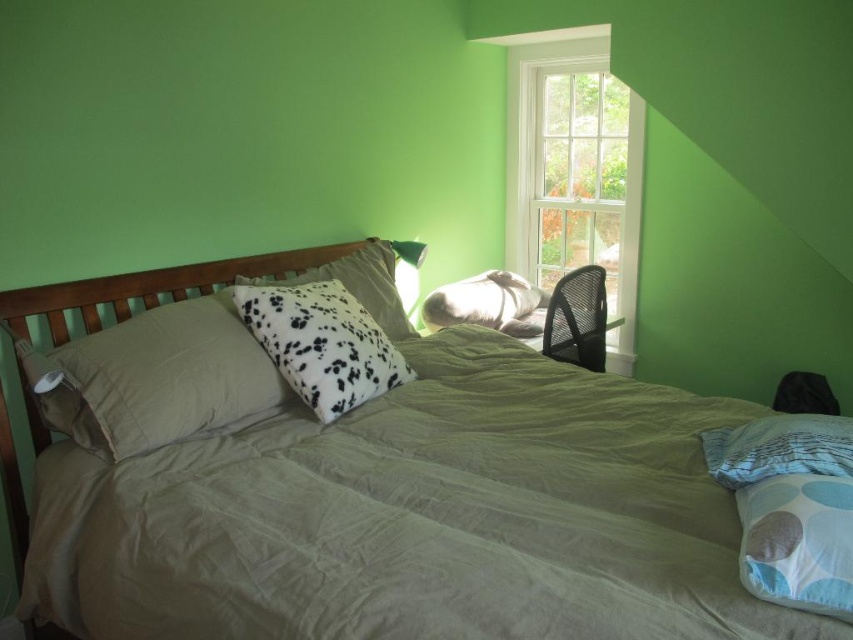
You are arranging a small table between the matte khaki bed at center and the white dotted pillow at upper center. If the table is 1.2 meters wide, will it fit between them?

The matte khaki bed at center is wider than the white dotted pillow at upper center. However, the exact distance between them isn

You are standing in the bedroom and want to look out the white wood window at upper center. To do this, should you turn your head to the right or left from facing the wooden headboard at upper left?

Since the white wood window at upper center is to the right of the wooden headboard at upper left, you should turn your head to the right to look out the window.